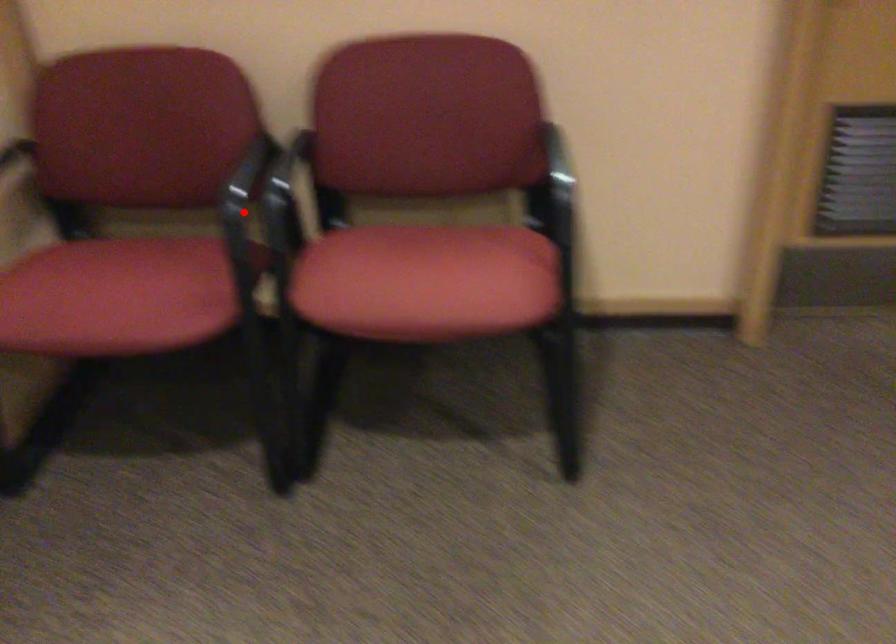
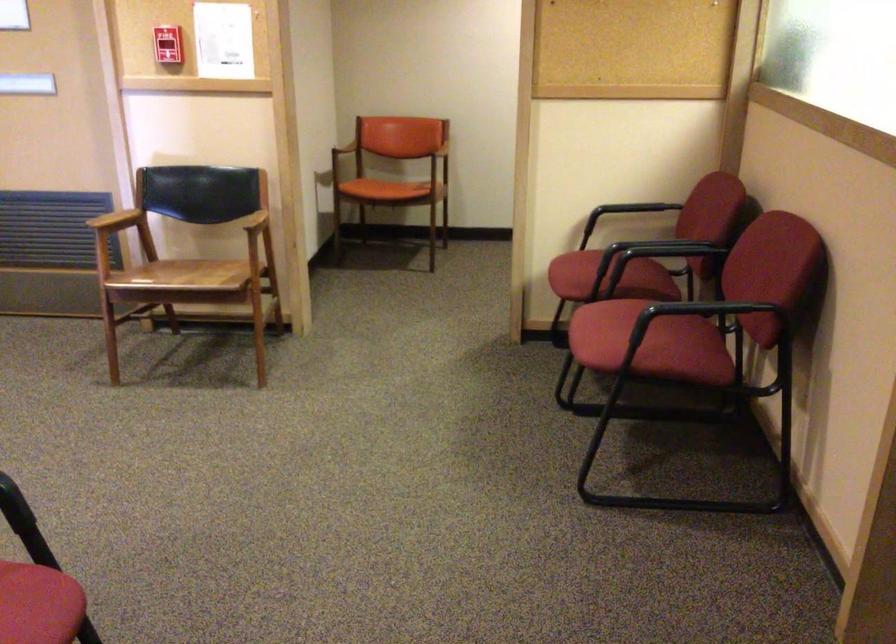
Where in the second image is the point corresponding to the highlighted location from the first image?

(602, 250)